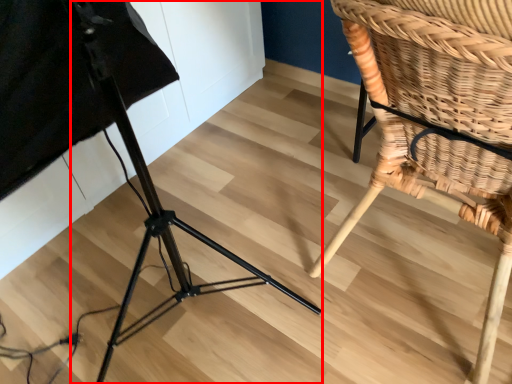
Question: From the image's perspective, what is the correct spatial positioning of tripod (annotated by the red box) in reference to chair?

Choices:
 (A) below
 (B) above

Answer: (A)